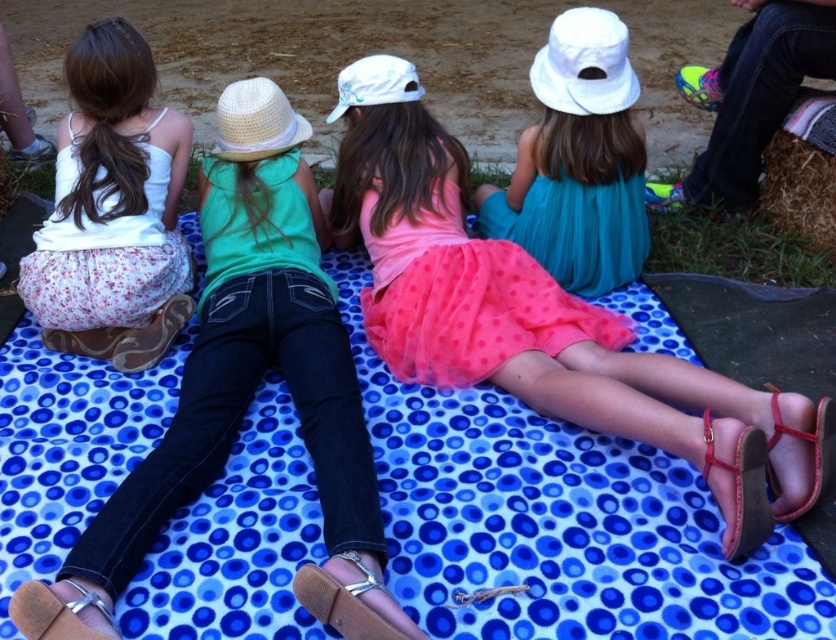
You are a photographer standing at the edge of the scene. You need to place a small prop at the exact location where the brown leather sandal at lower left is located. According to the coordinates given, where should you place the prop?

Place the prop at the coordinates point (55, 612) where the brown leather sandal at lower left is located.